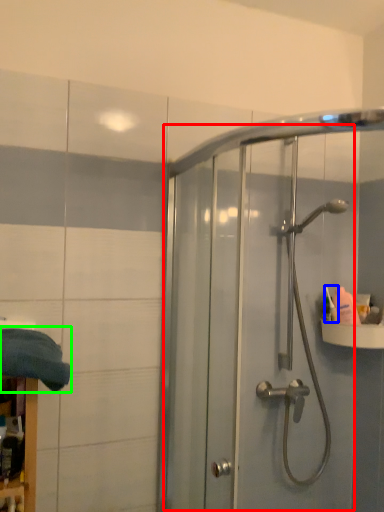
Question: Considering the real-world distances, which object is closest to screen door (highlighted by a red box)? toiletry (highlighted by a blue box) or bath towel (highlighted by a green box).

Choices:
 (A) toiletry
 (B) bath towel

Answer: (A)